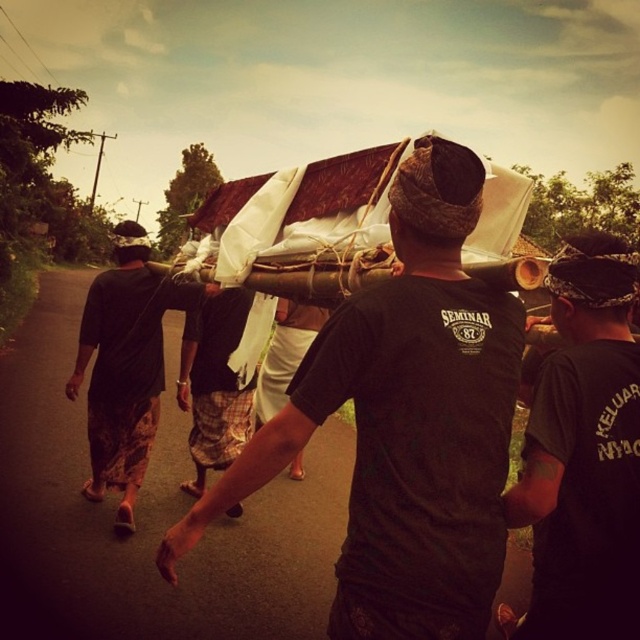
Describe the element at coordinates (124, 365) in the screenshot. I see `dark brown woven cloth at center` at that location.

Describe the element at coordinates (124, 365) in the screenshot. This screenshot has width=640, height=640. I see `dark brown woven cloth at center` at that location.

You are a GUI agent. You are given a task and a screenshot of the screen. Output one action in this format:
    pyautogui.click(x=<x>, y=<y>)
    Task: Click on the dark brown woven cloth at center
    The image size is (640, 640).
    Given the screenshot: What is the action you would take?
    pyautogui.click(x=124, y=365)

Can you confirm if brown woven basket at center is positioned to the right of black fabric at center?

No, brown woven basket at center is not to the right of black fabric at center.

Who is taller, brown woven basket at center or black fabric at center?

With more height is brown woven basket at center.

The height and width of the screenshot is (640, 640). In order to click on brown woven basket at center in this screenshot , I will do `click(404, 420)`.

Is brown woven basket at center positioned before black woven hat at upper left?

Yes, it is.

What do you see at coordinates (404, 420) in the screenshot? I see `brown woven basket at center` at bounding box center [404, 420].

Locate an element on the screen. The width and height of the screenshot is (640, 640). brown woven basket at center is located at coordinates (404, 420).